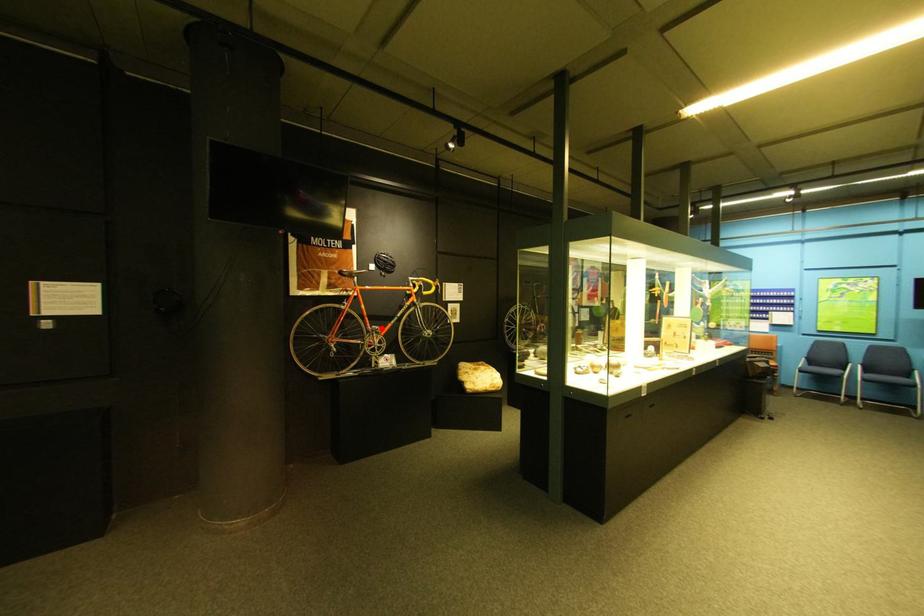
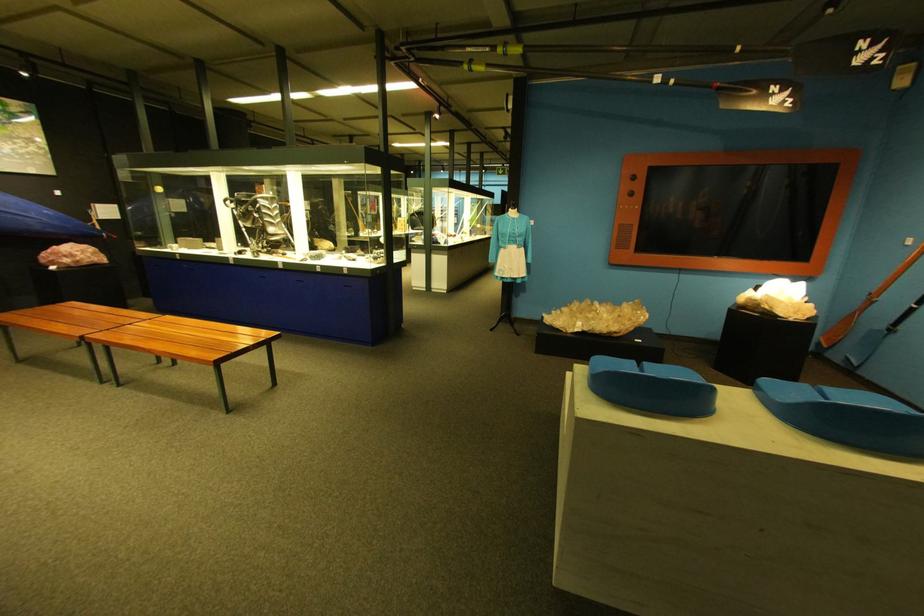
Question: I am providing you with two images of the same scene from different viewpoints. A red point is marked on the first image. Is the red point's position out of view in image 2?

Choices:
 (A) Yes
 (B) No

Answer: (A)